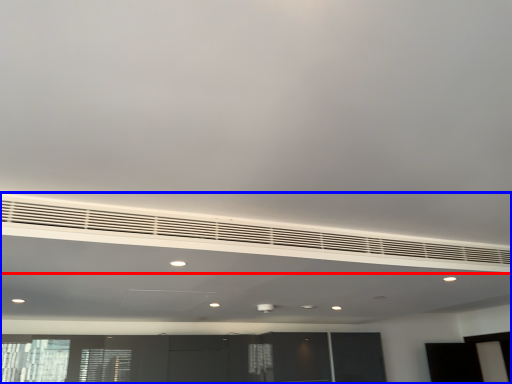
Question: Which point is closer to the camera, air conditioning (highlighted by a red box) or entertainment center (highlighted by a blue box)?

Choices:
 (A) air conditioning
 (B) entertainment center

Answer: (B)